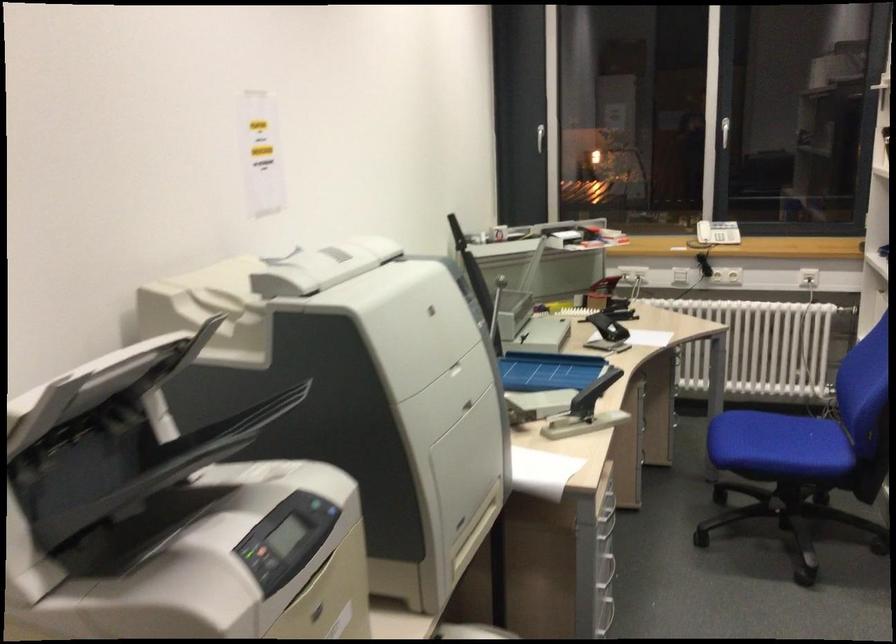
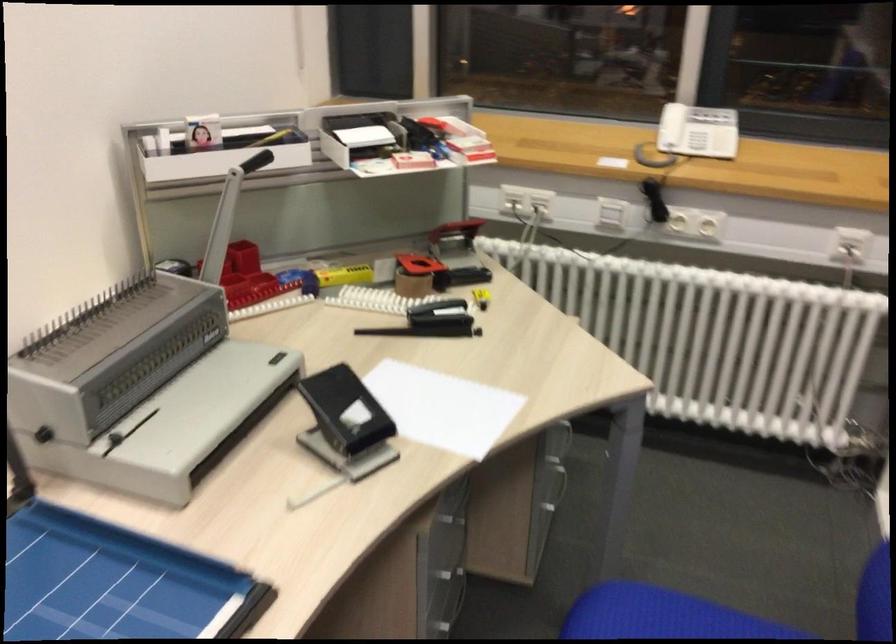
Locate, in the second image, the point that corresponds to point (553, 237) in the first image.

(334, 149)